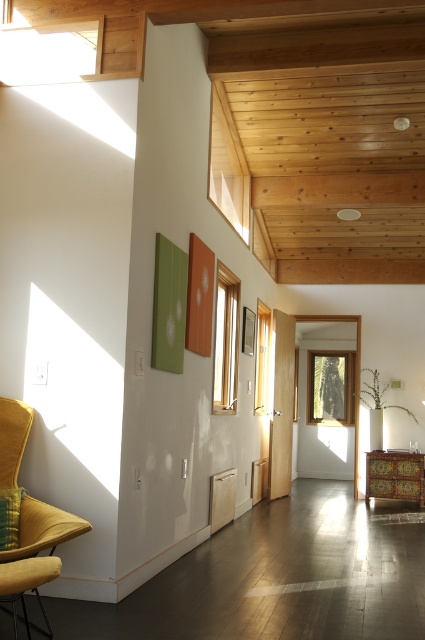
Is vividly painted wooden cabinet at center positioned before velvet yellow pillow at left?

No, it is behind velvet yellow pillow at left.

Is vividly painted wooden cabinet at center above velvet yellow pillow at left?

Incorrect, vividly painted wooden cabinet at center is not positioned above velvet yellow pillow at left.

Find the location of a particular element. vividly painted wooden cabinet at center is located at coordinates (394, 476).

Is velvet yellow armchair at left further to camera compared to velvet yellow pillow at left?

No, velvet yellow armchair at left is in front of velvet yellow pillow at left.

Does velvet yellow armchair at left have a greater height compared to velvet yellow pillow at left?

Yes, velvet yellow armchair at left is taller than velvet yellow pillow at left.

Find the location of `velvet yellow armchair at left`. velvet yellow armchair at left is located at coordinates (34, 556).

Locate an element on the screen. The height and width of the screenshot is (640, 425). velvet yellow armchair at left is located at coordinates (34, 556).

Can you confirm if velvet yellow armchair at left is positioned to the left of vividly painted wooden cabinet at center?

Indeed, velvet yellow armchair at left is positioned on the left side of vividly painted wooden cabinet at center.

Is velvet yellow armchair at left positioned before vividly painted wooden cabinet at center?

Yes, it is.

Describe the element at coordinates (34, 556) in the screenshot. I see `velvet yellow armchair at left` at that location.

Where is `velvet yellow armchair at left`? The image size is (425, 640). velvet yellow armchair at left is located at coordinates (34, 556).